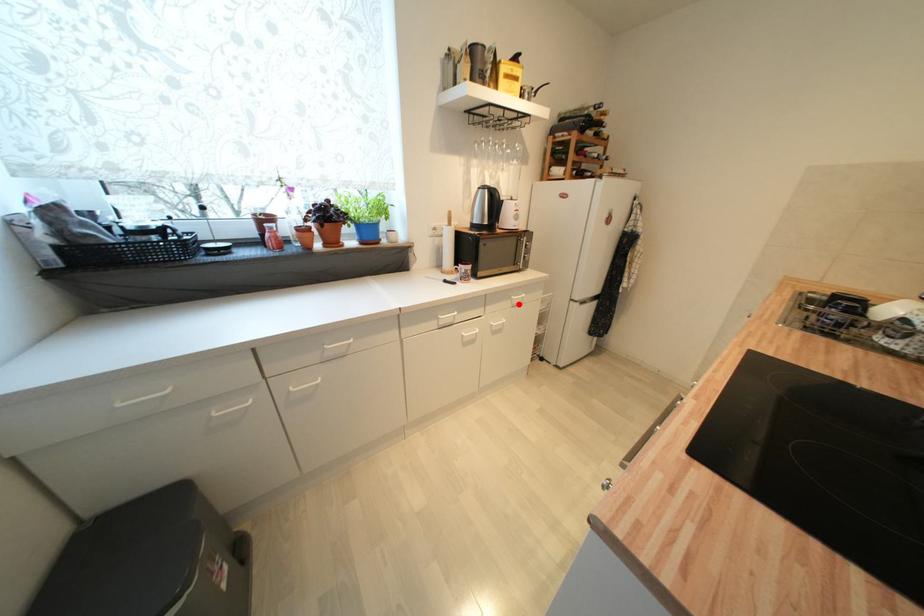
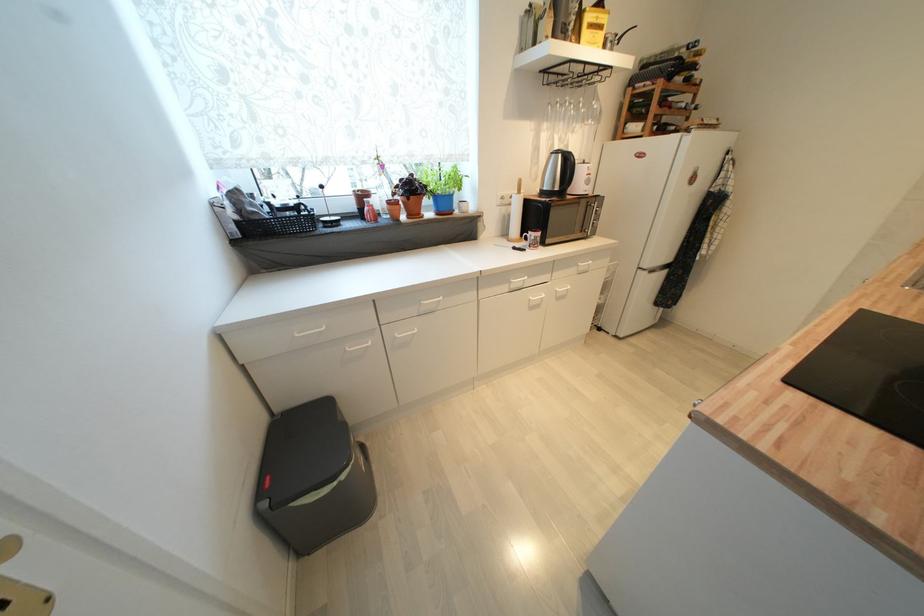
The point at the highlighted location is marked in the first image. Where is the corresponding point in the second image?

(585, 270)